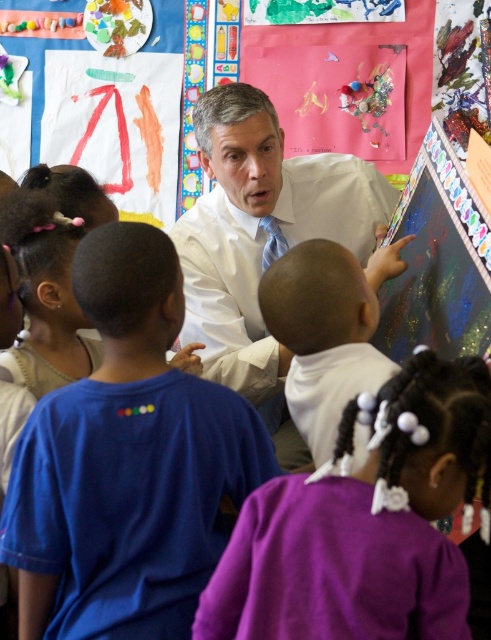
Between point (381, 632) and point (296, 323), which one is positioned behind?

The point (296, 323) is behind.

Measure the distance between purple fabric at lower center and white matte shirt at center.

The distance of purple fabric at lower center from white matte shirt at center is 59.85 centimeters.

Which is in front, point (278, 483) or point (297, 273)?

Point (278, 483) is in front.

The width and height of the screenshot is (491, 640). Find the location of `purple fabric at lower center`. purple fabric at lower center is located at coordinates (364, 524).

Who is positioned more to the right, white smooth shirt at center or white matte shirt at center?

Positioned to the right is white matte shirt at center.

Does white smooth shirt at center have a greater width compared to white matte shirt at center?

Yes, white smooth shirt at center is wider than white matte shirt at center.

Which is behind, point (235, 205) or point (348, 388)?

Positioned behind is point (235, 205).

This screenshot has height=640, width=491. I want to click on white smooth shirt at center, so click(265, 234).

Can you confirm if blue cotton shirt at center is thinner than purple fabric at lower center?

No.

Which is above, blue cotton shirt at center or purple fabric at lower center?

blue cotton shirt at center

At what (x,y) coordinates should I click in order to perform the action: click on blue cotton shirt at center. Please return your answer as a coordinate pair (x, y). Looking at the image, I should click on (127, 461).

I want to click on blue cotton shirt at center, so click(x=127, y=461).